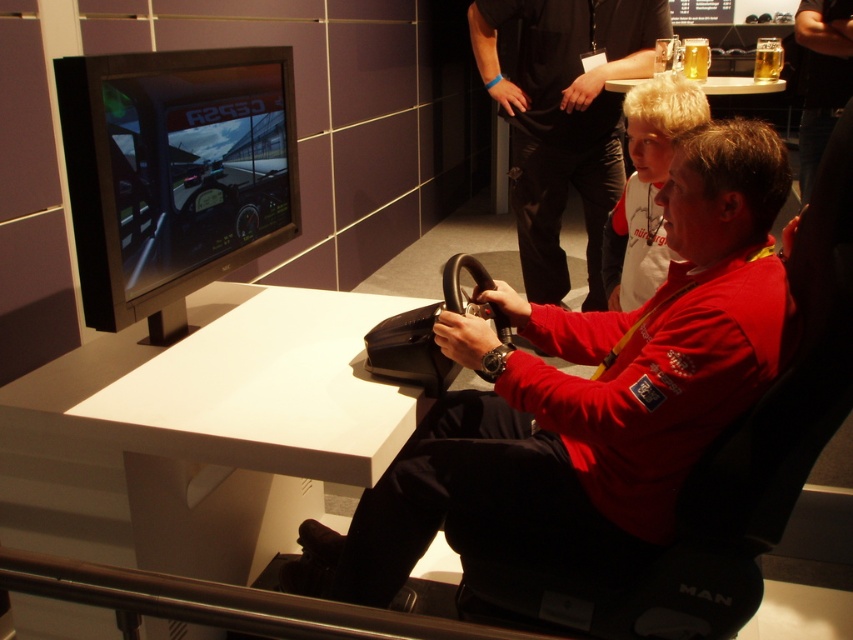
You are a photographer standing 2 meters away from the scene. You want to take a photo that includes both the matte red shirt at center and the white cotton shirt at upper center. Can you fit both in your camera frame if your camera has a minimum field of view of 1 meter width?

The matte red shirt at center and white cotton shirt at upper center are 66.85 centimeters apart from each other. Since the camera requires a minimum field of view of 1 meter width, which is 100 centimeters, the distance between them is less than the required field of view. Therefore, both can be captured in the photo.

Please describe the location of the point labeled as point (585, 397) in the scene described above.

The point labeled as point (585, 397) is located on the matte black steering wheel at center.

You are standing in the exhibition hall and notice the matte black steering wheel at center and the matte red shirt at center. Which object is positioned closer to you?

The matte black steering wheel at center is closer to the viewer than the matte red shirt at center.